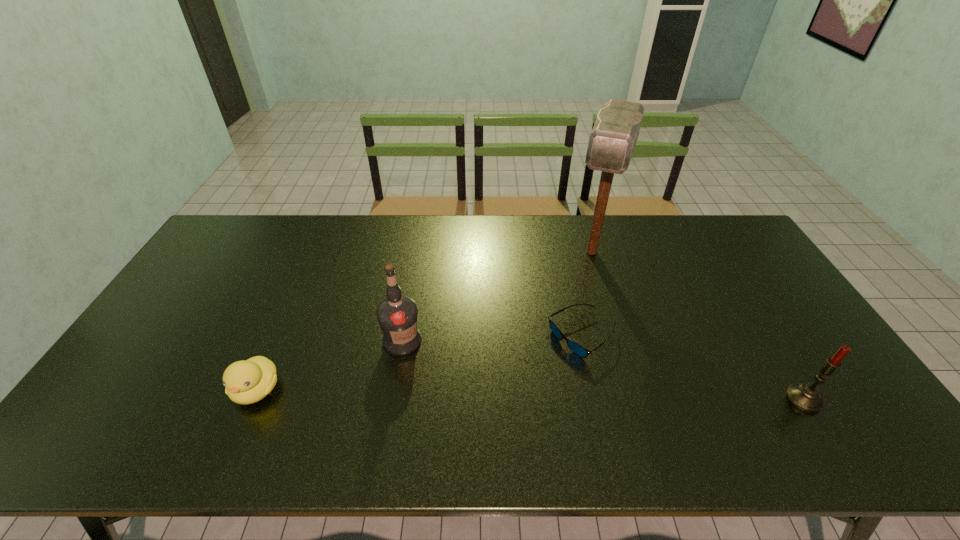
Identify the location of vacant space that is in between the fourth shortest object and the rightmost object. This screenshot has height=540, width=960. (603, 370).

The width and height of the screenshot is (960, 540). Identify the location of free space between the sunglasses and the fourth shortest object. (492, 339).

Image resolution: width=960 pixels, height=540 pixels. I want to click on free space between the shortest object and the farthest object, so click(x=587, y=294).

This screenshot has width=960, height=540. I want to click on vacant area that lies between the candle and the second shortest object, so click(x=530, y=394).

Where is `free space between the vodka and the leftmost object`? free space between the vodka and the leftmost object is located at coordinates (329, 365).

Where is `free space between the second object from left to right and the tallest object`? free space between the second object from left to right and the tallest object is located at coordinates (497, 296).

Where is `vacant area that lies between the farthest object and the second object from left to right`? The width and height of the screenshot is (960, 540). vacant area that lies between the farthest object and the second object from left to right is located at coordinates (497, 296).

The width and height of the screenshot is (960, 540). Find the location of `free space that is in between the shortest object and the candle`. free space that is in between the shortest object and the candle is located at coordinates (692, 368).

Identify the location of object that is the fourth closest to the second tallest object. (807, 397).

Select which object appears as the third closest to the shortest object. Please provide its 2D coordinates. Your answer should be formatted as a tuple, i.e. [(x, y)], where the tuple contains the x and y coordinates of a point satisfying the conditions above.

[(807, 397)]